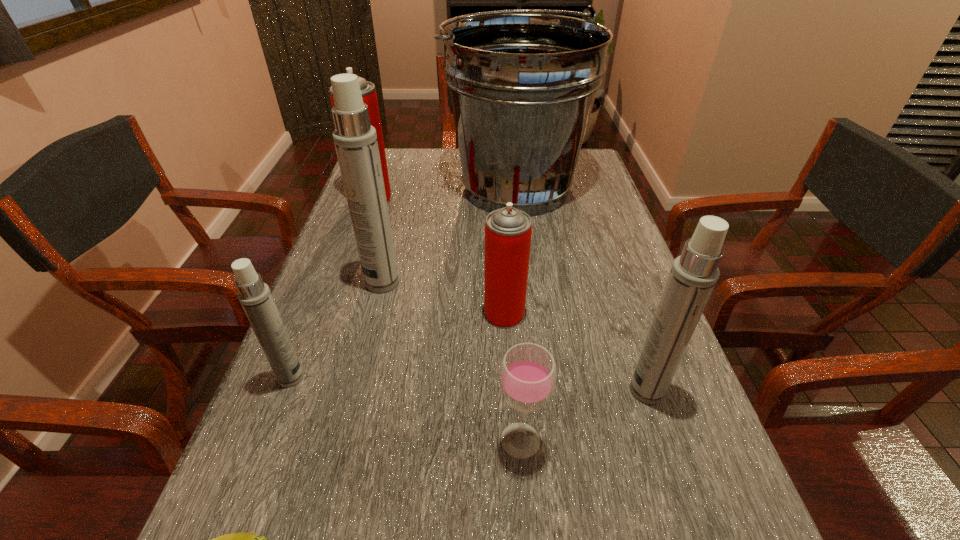
Where is `the second nearest object`? This screenshot has height=540, width=960. the second nearest object is located at coordinates (527, 377).

The width and height of the screenshot is (960, 540). What are the coordinates of `wineglass` in the screenshot? It's located at point(527,377).

The width and height of the screenshot is (960, 540). I want to click on vacant space located 0.100m on the front of the bucket, so click(x=523, y=251).

Locate an element on the screen. The height and width of the screenshot is (540, 960). free region located on the right of the second white aerosol can from right to left is located at coordinates (495, 282).

Identify the location of blank space located on the back of the bigger red aerosol can. (388, 154).

Locate an element on the screen. The height and width of the screenshot is (540, 960). free region located on the back of the second smallest white aerosol can is located at coordinates (620, 311).

Locate an element on the screen. The height and width of the screenshot is (540, 960). vacant space located on the front of the fourth farthest object is located at coordinates (507, 360).

This screenshot has width=960, height=540. I want to click on vacant space situated 0.100m on the right of the smallest white aerosol can, so click(x=358, y=377).

Find the location of `vacant region located on the back of the second shortest object`. vacant region located on the back of the second shortest object is located at coordinates (512, 320).

Identify the location of object located in the far edge section of the desktop. The width and height of the screenshot is (960, 540). (522, 85).